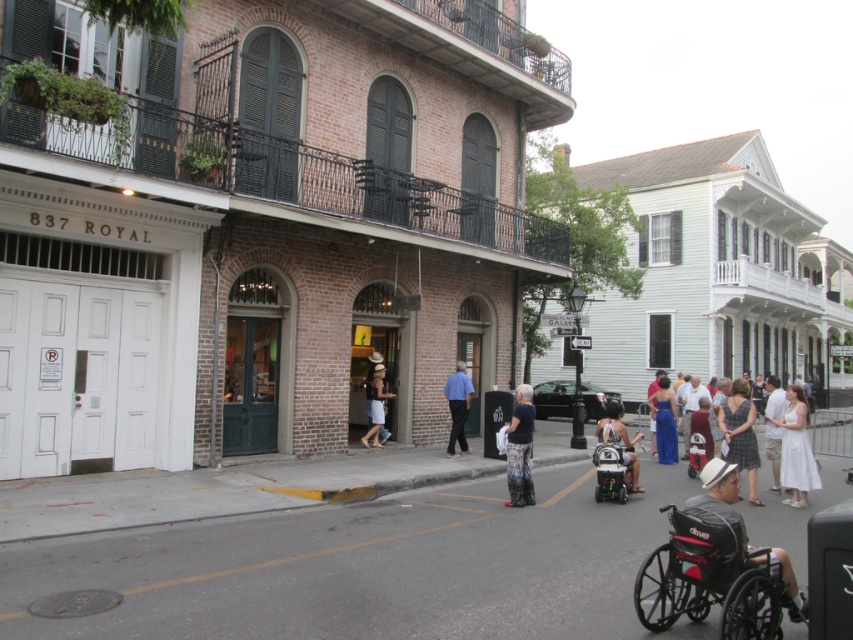
Looking at this image, you are a delivery person needing to navigate to the entrance of the 837 ROYAL building. You see a black plastic wheelchair at center. Is the wheelchair blocking your path to the entrance?

The black plastic wheelchair at center is located at point (611,472), which does not block the path to the entrance of the 837 ROYAL building.